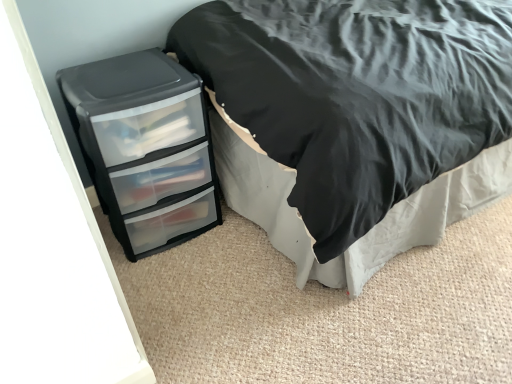
Where is `black matte bed at left`? This screenshot has height=384, width=512. black matte bed at left is located at coordinates (355, 121).

What do you see at coordinates (355, 121) in the screenshot? I see `black matte bed at left` at bounding box center [355, 121].

This screenshot has height=384, width=512. I want to click on black plastic chest of drawers at lower left, so click(145, 148).

Describe the element at coordinates (145, 148) in the screenshot. The width and height of the screenshot is (512, 384). I see `black plastic chest of drawers at lower left` at that location.

Identify the location of black matte bed at left. (355, 121).

Can you confirm if black matte bed at left is positioned to the right of black plastic chest of drawers at lower left?

Yes, black matte bed at left is to the right of black plastic chest of drawers at lower left.

Considering the positions of objects black matte bed at left and black plastic chest of drawers at lower left in the image provided, who is behind, black matte bed at left or black plastic chest of drawers at lower left?

black plastic chest of drawers at lower left is more distant.

Which is farther from the camera, (291, 127) or (102, 140)?

The point (102, 140) is more distant.

From the image's perspective, between black matte bed at left and black plastic chest of drawers at lower left, which one is located above?

black matte bed at left appears higher in the image.

From a real-world perspective, is black matte bed at left on top of black plastic chest of drawers at lower left?

Yes.

Which of these two, black matte bed at left or black plastic chest of drawers at lower left, is thinner?

black plastic chest of drawers at lower left is thinner.

Who is shorter, black matte bed at left or black plastic chest of drawers at lower left?

With less height is black plastic chest of drawers at lower left.

Is black matte bed at left bigger than black plastic chest of drawers at lower left?

Yes.

Is black matte bed at left inside the boundaries of black plastic chest of drawers at lower left, or outside?

black matte bed at left exists outside the volume of black plastic chest of drawers at lower left.

Are black matte bed at left and black plastic chest of drawers at lower left far apart?

black matte bed at left is actually quite close to black plastic chest of drawers at lower left.

Does black matte bed at left turn towards black plastic chest of drawers at lower left?

Yes.

What's the angular difference between black matte bed at left and black plastic chest of drawers at lower left's facing directions?

87.1 degrees.

What are the coordinates of `chest of drawers lying on the left of black matte bed at left` in the screenshot? It's located at (145, 148).

Is black plastic chest of drawers at lower left to the right of black matte bed at left from the viewer's perspective?

Incorrect, black plastic chest of drawers at lower left is not on the right side of black matte bed at left.

Does black plastic chest of drawers at lower left come in front of black matte bed at left?

No.

Is point (133, 184) positioned behind point (374, 136)?

That is True.

From the image's perspective, which is above, black plastic chest of drawers at lower left or black matte bed at left?

black matte bed at left is shown above in the image.

From a real-world perspective, is black plastic chest of drawers at lower left beneath black matte bed at left?

Yes, from a real-world perspective, black plastic chest of drawers at lower left is beneath black matte bed at left.

Can you confirm if black plastic chest of drawers at lower left is wider than black matte bed at left?

No, black plastic chest of drawers at lower left is not wider than black matte bed at left.

Does black plastic chest of drawers at lower left have a lesser height compared to black matte bed at left?

Indeed, black plastic chest of drawers at lower left has a lesser height compared to black matte bed at left.

Does black plastic chest of drawers at lower left have a smaller size compared to black matte bed at left?

Correct, black plastic chest of drawers at lower left occupies less space than black matte bed at left.

Is black plastic chest of drawers at lower left positioned beyond the bounds of black matte bed at left?

That's correct, black plastic chest of drawers at lower left is outside of black matte bed at left.

Is black plastic chest of drawers at lower left far from black matte bed at left?

They are positioned close to each other.

Does black plastic chest of drawers at lower left turn towards black matte bed at left?

No, black plastic chest of drawers at lower left is not turned towards black matte bed at left.

Can you tell me how much black plastic chest of drawers at lower left and black matte bed at left differ in facing direction?

They differ by 87.1 degrees in their facing directions.

Locate an element on the screen. chest of drawers that appears on the left of black matte bed at left is located at coordinates click(145, 148).

At what (x,y) coordinates should I click in order to perform the action: click on the chest of drawers that appears below the black matte bed at left (from the image's perspective). Please return your answer as a coordinate pair (x, y). Image resolution: width=512 pixels, height=384 pixels. Looking at the image, I should click on (145, 148).

At what (x,y) coordinates should I click in order to perform the action: click on bed above the black plastic chest of drawers at lower left (from a real-world perspective). Please return your answer as a coordinate pair (x, y). Looking at the image, I should click on (355, 121).